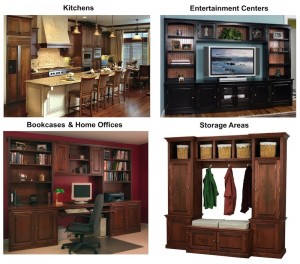
Locate an element on the screen. computer tower is located at coordinates (104, 228).